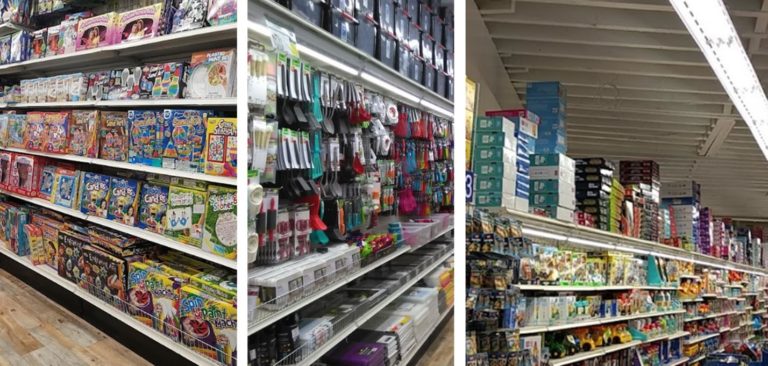
Identify the location of top shelve. The width and height of the screenshot is (768, 366). (339, 49).